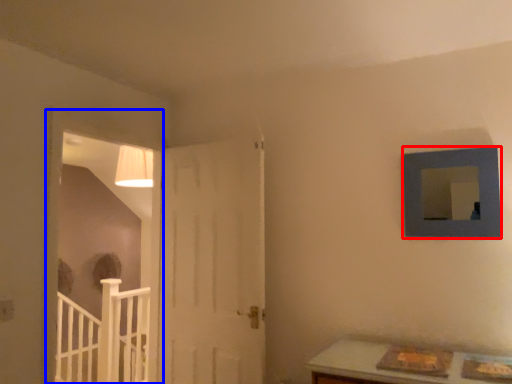
Question: Among these objects, which one is nearest to the camera, picture frame (highlighted by a red box) or window frame (highlighted by a blue box)?

Choices:
 (A) picture frame
 (B) window frame

Answer: (A)